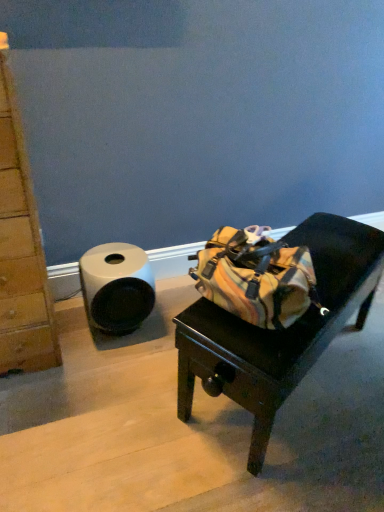
Image resolution: width=384 pixels, height=512 pixels. I want to click on free space in front of multicolored fabric bag at center, so pos(293,457).